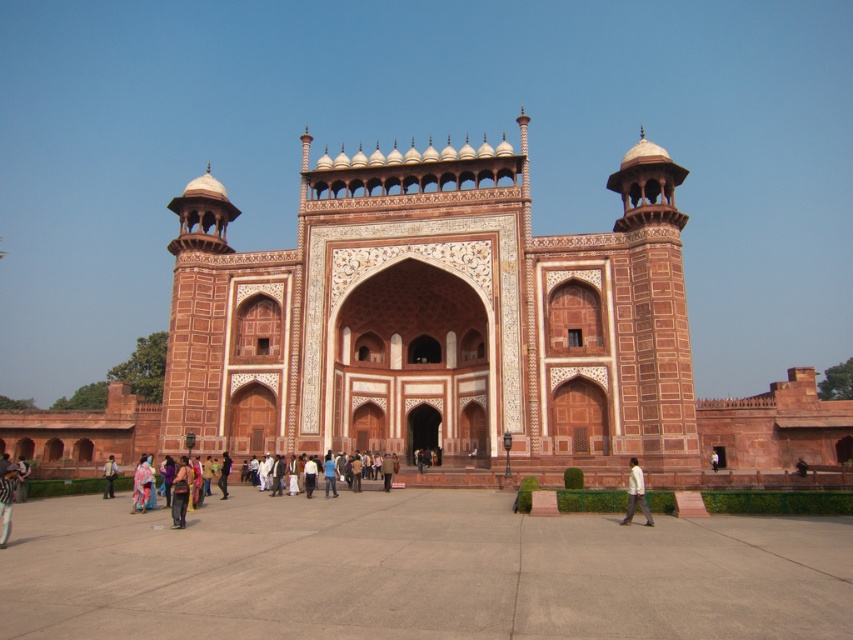
Is point (523, 132) positioned after point (107, 480)?

Yes, it is.

In the scene shown: Does reddish-brown stone archway at center have a greater height compared to light brown fabric jacket at lower left?

Yes.

Describe the element at coordinates (434, 317) in the screenshot. The height and width of the screenshot is (640, 853). I see `reddish-brown stone archway at center` at that location.

Where is `reddish-brown stone archway at center`? The image size is (853, 640). reddish-brown stone archway at center is located at coordinates (434, 317).

Between dark brown leather pants at lower left and light brown fabric jacket at lower left, which one has more height?

dark brown leather pants at lower left is taller.

Is point (187, 465) in front of point (115, 468)?

Yes, point (187, 465) is closer to viewer.

Locate an element on the screen. dark brown leather pants at lower left is located at coordinates (180, 492).

Locate an element on the screen. Image resolution: width=853 pixels, height=640 pixels. dark brown leather pants at lower left is located at coordinates (180, 492).

Can you confirm if white matte shirt at lower right is thinner than multicolored fabric at center?

Correct, white matte shirt at lower right's width is less than multicolored fabric at center's.

Which is more to the left, white matte shirt at lower right or multicolored fabric at center?

From the viewer's perspective, multicolored fabric at center appears more on the left side.

Does point (637, 486) come farther from viewer compared to point (132, 492)?

No, (637, 486) is in front of (132, 492).

Find the location of a particular element. The width and height of the screenshot is (853, 640). white matte shirt at lower right is located at coordinates (635, 493).